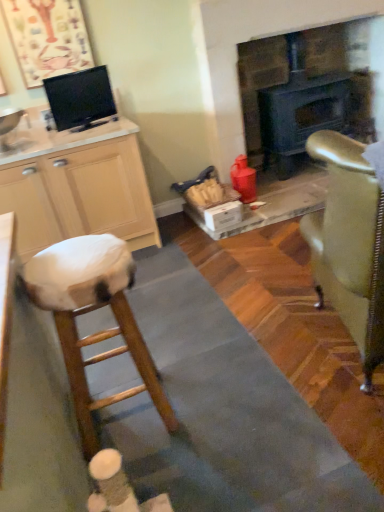
Question: Considering the relative sizes of black glossy tv at upper left and wooden stool at left in the image provided, is black glossy tv at upper left smaller than wooden stool at left?

Choices:
 (A) no
 (B) yes

Answer: (B)

Question: From a real-world perspective, is black glossy tv at upper left positioned over wooden stool at left based on gravity?

Choices:
 (A) no
 (B) yes

Answer: (B)

Question: Is black glossy tv at upper left turned away from wooden stool at left?

Choices:
 (A) no
 (B) yes

Answer: (A)

Question: Is black glossy tv at upper left surrounding wooden stool at left?

Choices:
 (A) no
 (B) yes

Answer: (A)

Question: From the image's perspective, is black glossy tv at upper left below wooden stool at left?

Choices:
 (A) yes
 (B) no

Answer: (B)

Question: Is matte black fireplace at center taller or shorter than wooden stool at left?

Choices:
 (A) tall
 (B) short

Answer: (A)

Question: From a real-world perspective, is matte black fireplace at center positioned above or below wooden stool at left?

Choices:
 (A) above
 (B) below

Answer: (A)

Question: Is matte black fireplace at center spatially inside wooden stool at left, or outside of it?

Choices:
 (A) inside
 (B) outside

Answer: (B)

Question: From the image's perspective, is matte black fireplace at center located above or below wooden stool at left?

Choices:
 (A) below
 (B) above

Answer: (B)

Question: Does point (72, 128) appear closer or farther from the camera than point (44, 204)?

Choices:
 (A) farther
 (B) closer

Answer: (A)

Question: Considering the relative positions of black glossy tv at upper left and beige wood cabinet at left in the image provided, is black glossy tv at upper left to the left or to the right of beige wood cabinet at left?

Choices:
 (A) right
 (B) left

Answer: (A)

Question: Is black glossy tv at upper left in front of or behind beige wood cabinet at left in the image?

Choices:
 (A) front
 (B) behind

Answer: (B)

Question: From a real-world perspective, relative to beige wood cabinet at left, is black glossy tv at upper left vertically above or below?

Choices:
 (A) below
 (B) above

Answer: (B)

Question: Is point (107, 97) closer or farther from the camera than point (69, 367)?

Choices:
 (A) closer
 (B) farther

Answer: (B)

Question: Would you say black glossy tv at upper left is to the left or to the right of wooden stool at left in the picture?

Choices:
 (A) left
 (B) right

Answer: (A)